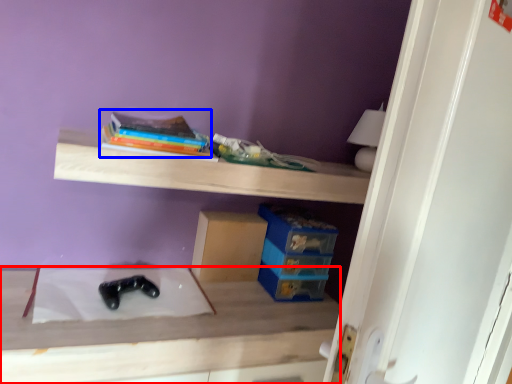
Question: Among these objects, which one is nearest to the camera, table (highlighted by a red box) or book (highlighted by a blue box)?

Choices:
 (A) table
 (B) book

Answer: (A)